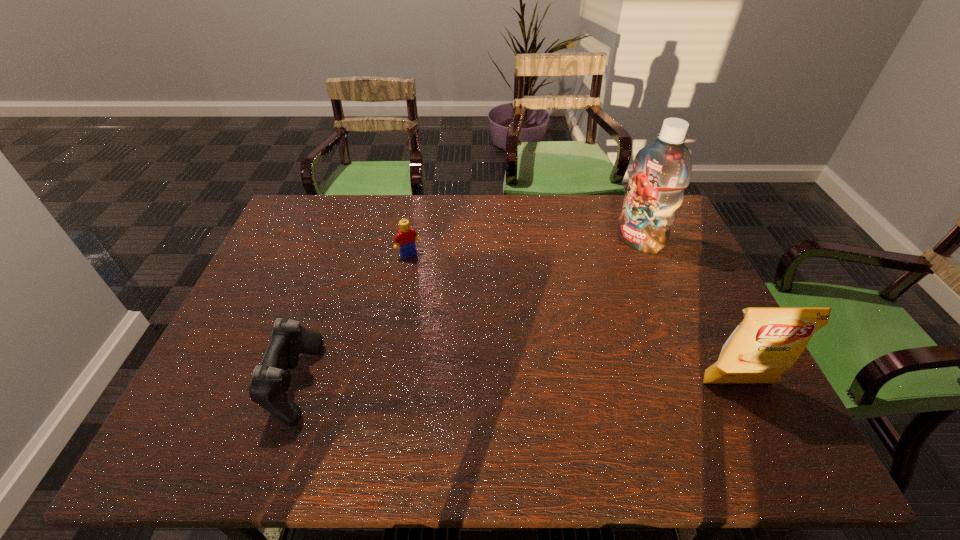
Locate an element on the screen. The image size is (960, 540). free space between the leftmost object and the Lego is located at coordinates click(x=351, y=319).

Where is `vacant space that is in between the shampoo and the third object from right to left`? vacant space that is in between the shampoo and the third object from right to left is located at coordinates (524, 248).

Image resolution: width=960 pixels, height=540 pixels. Identify the location of vacant area that lies between the Lego and the second tallest object. (573, 319).

Where is `free space between the control and the Lego`? This screenshot has height=540, width=960. free space between the control and the Lego is located at coordinates (351, 319).

Identify the location of blank region between the control and the crisp (potato chip). (516, 383).

You are a GUI agent. You are given a task and a screenshot of the screen. Output one action in this format:
    pyautogui.click(x=<x>, y=<y>)
    Task: Click on the vacant space in between the shampoo and the control
    The height and width of the screenshot is (540, 960).
    Given the screenshot: What is the action you would take?
    pyautogui.click(x=467, y=312)

Select which object is the third closest to the Lego. Please provide its 2D coordinates. Your answer should be formatted as a tuple, i.e. [(x, y)], where the tuple contains the x and y coordinates of a point satisfying the conditions above.

[(769, 340)]

This screenshot has width=960, height=540. Find the location of `the third closest object to the second tallest object`. the third closest object to the second tallest object is located at coordinates (269, 382).